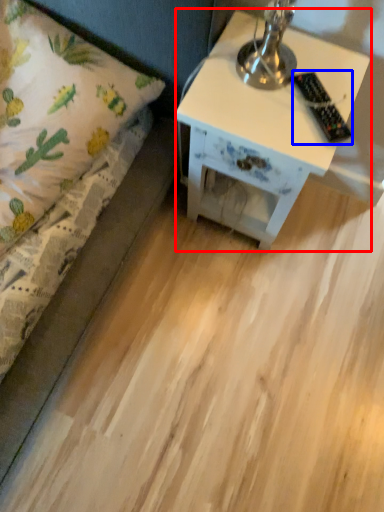
Question: Among these objects, which one is nearest to the camera, nightstand (highlighted by a red box) or remote control (highlighted by a blue box)?

Choices:
 (A) nightstand
 (B) remote control

Answer: (B)